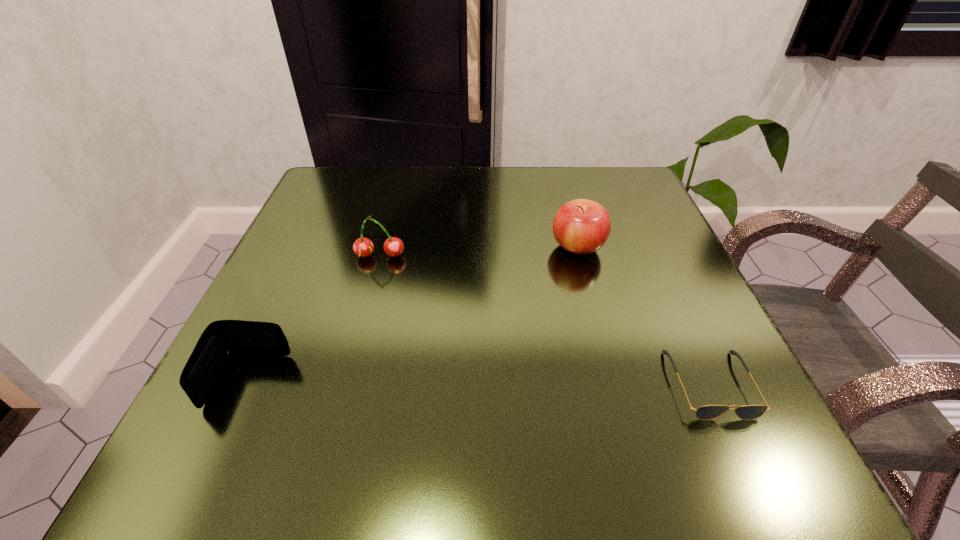
Where is `wallet that is at the left edge`? The width and height of the screenshot is (960, 540). wallet that is at the left edge is located at coordinates (221, 339).

The width and height of the screenshot is (960, 540). I want to click on apple that is positioned at the right edge, so click(x=581, y=226).

Locate an element on the screen. This screenshot has height=540, width=960. sunglasses at the right edge is located at coordinates (707, 412).

At what (x,y) coordinates should I click in order to perform the action: click on object present at the near right corner. Please return your answer as a coordinate pair (x, y). The image size is (960, 540). Looking at the image, I should click on (707, 412).

Find the location of a particular element. Image resolution: width=960 pixels, height=540 pixels. vacant space at the far edge of the desktop is located at coordinates (455, 218).

The width and height of the screenshot is (960, 540). In order to click on free region at the near edge of the desktop in this screenshot , I will do `click(482, 452)`.

I want to click on vacant space at the left edge, so click(x=308, y=226).

Find the location of a particular element. This screenshot has width=960, height=540. free space at the right edge of the desktop is located at coordinates (659, 370).

I want to click on vacant area at the far left corner, so click(320, 220).

Where is `free region at the near left corner`? The height and width of the screenshot is (540, 960). free region at the near left corner is located at coordinates (186, 480).